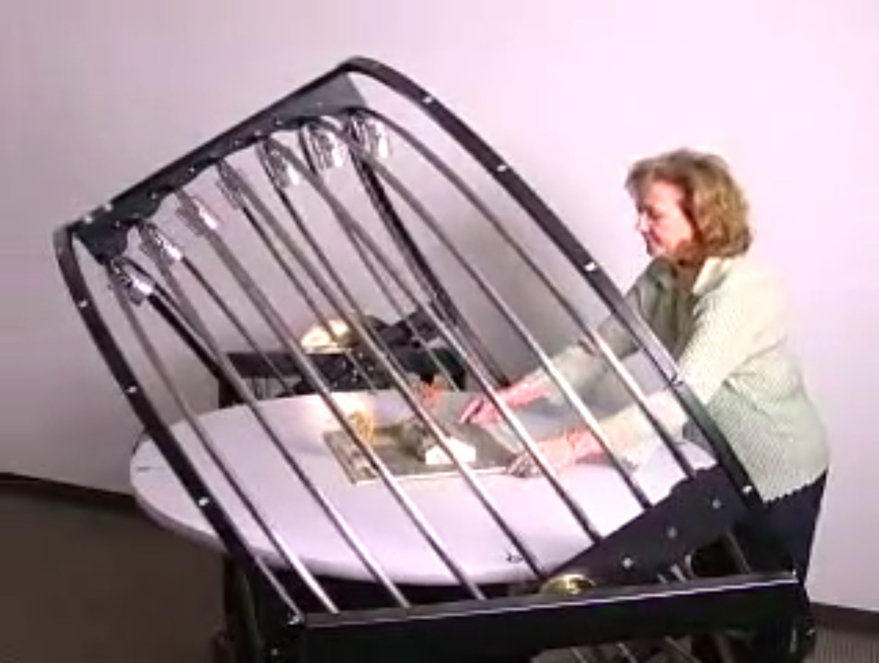
This screenshot has width=879, height=663. I want to click on rug, so click(x=44, y=583).